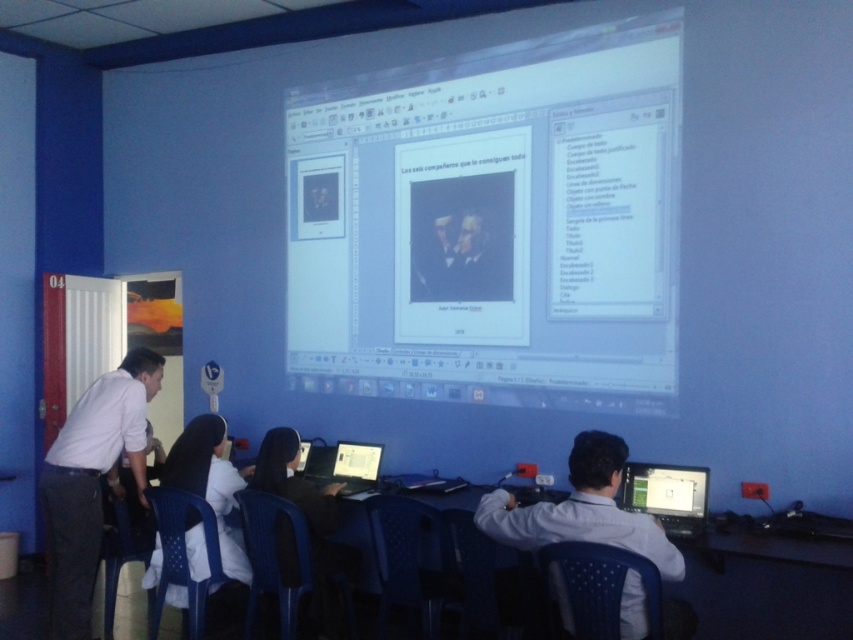
Question: Estimate the real-world distances between objects in this image. Which object is closer to the white shirt at lower right?

Choices:
 (A) white glossy projector screen at upper center
 (B) black glossy laptop at center
 (C) white plastic chair at center
 (D) white glossy monitor at lower right

Answer: (D)

Question: Considering the real-world distances, which object is closest to the white glossy projector screen at upper center?

Choices:
 (A) black glossy laptop at center
 (B) white shirt at left
 (C) white fabric at lower left

Answer: (A)

Question: Which point is farther to the camera?

Choices:
 (A) white glossy projector screen at upper center
 (B) white fabric at lower left
 (C) white shirt at lower right
 (D) white plastic chair at center

Answer: (A)

Question: Does white glossy projector screen at upper center lie behind black glossy laptop at center?

Choices:
 (A) no
 (B) yes

Answer: (A)

Question: Is white glossy monitor at lower right above smooth black portrait at center?

Choices:
 (A) yes
 (B) no

Answer: (B)

Question: Can you confirm if white shirt at lower right is bigger than white glossy monitor at lower right?

Choices:
 (A) no
 (B) yes

Answer: (B)